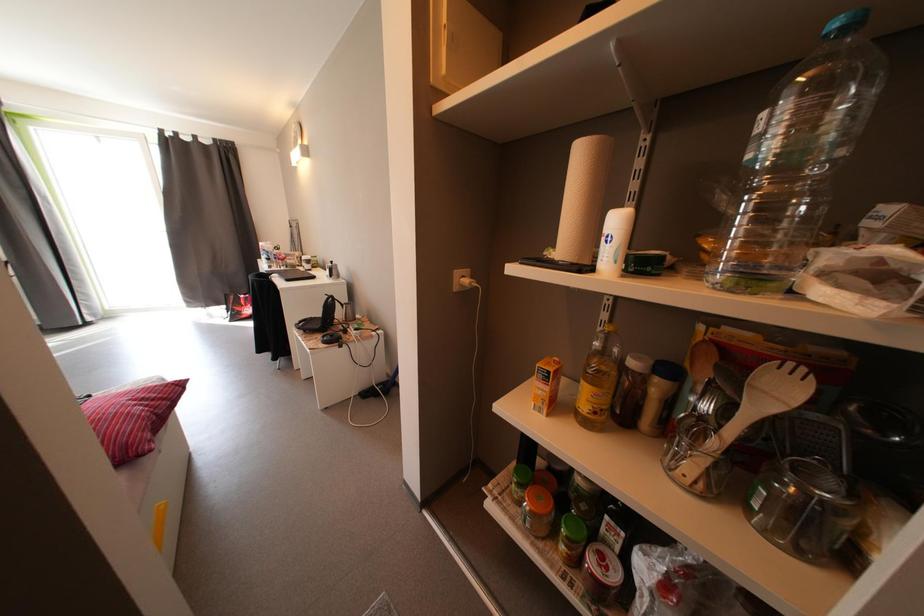
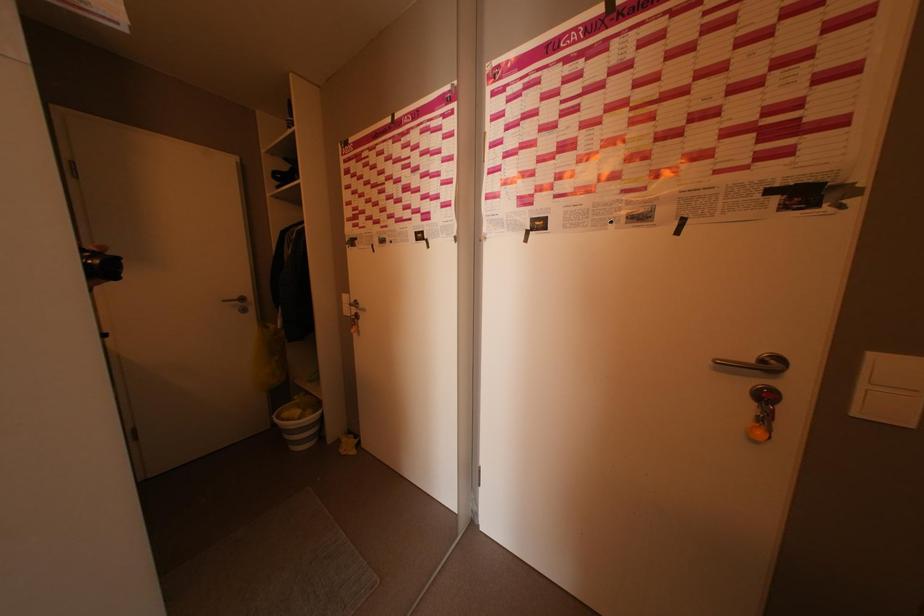
Question: How did the camera likely rotate?

Choices:
 (A) Left
 (B) Right
 (C) Up
 (D) Down

Answer: (B)